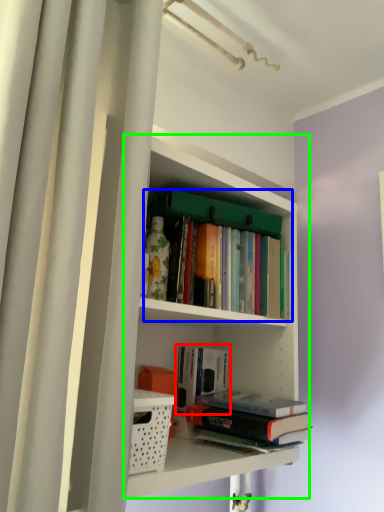
Question: Based on their relative distances, which object is nearer to book (highlighted by a red box)? Choose from book (highlighted by a blue box) and shelf (highlighted by a green box).

Choices:
 (A) book
 (B) shelf

Answer: (B)